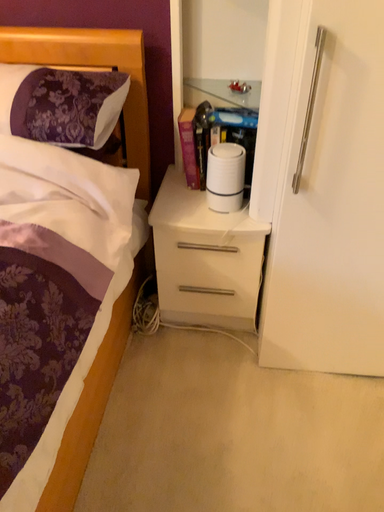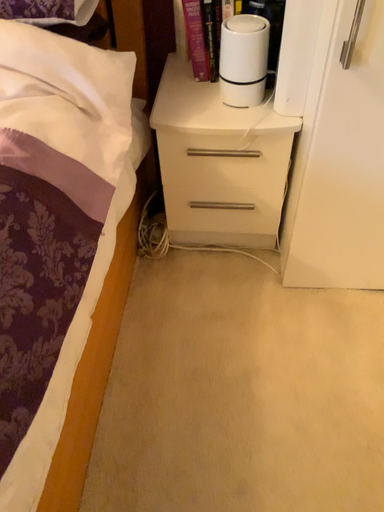
Question: Which way did the camera rotate in the video?

Choices:
 (A) rotated downward
 (B) rotated upward

Answer: (A)